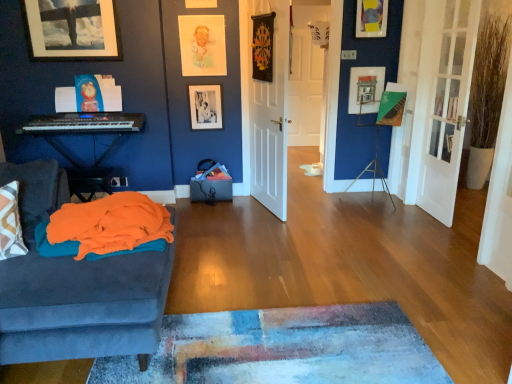
The height and width of the screenshot is (384, 512). What do you see at coordinates (371, 18) in the screenshot? I see `wooden picture frame at upper center, which appears as the 4th picture frame when viewed from the left` at bounding box center [371, 18].

Find the location of a particular element. The image size is (512, 384). orange fabric at left is located at coordinates (84, 133).

Describe the element at coordinates (306, 76) in the screenshot. I see `white wooden door at center, the first door viewed from the back` at that location.

The height and width of the screenshot is (384, 512). What do you see at coordinates (202, 45) in the screenshot?
I see `pastel paper portrait at upper center, which is counted as the third picture frame, starting from the right` at bounding box center [202, 45].

In order to face white matte door at center, acting as the second door starting from the back, should I rotate leftwards or rightwards?

Rotate your view right by about 1.167°.

This screenshot has height=384, width=512. I want to click on white glass door at right, which is counted as the first door, starting from the right, so click(x=442, y=103).

Locate an element on the screen. The width and height of the screenshot is (512, 384). matte black picture frame at upper left, which ranks as the fifth picture frame in right-to-left order is located at coordinates (72, 29).

Where is `wooden picture frame at upper center, which appears as the 4th picture frame when viewed from the left`? This screenshot has height=384, width=512. wooden picture frame at upper center, which appears as the 4th picture frame when viewed from the left is located at coordinates (371, 18).

Can white wooden door at center, the 2th door when ordered from right to left, be found inside orange soft fabric blanket at left?

No.

From a real-world perspective, does orange soft fabric blanket at left stand above white wooden door at center, the 2th door when ordered from right to left?

Incorrect, from a real-world perspective, orange soft fabric blanket at left is lower than white wooden door at center, the 2th door when ordered from right to left.

Who is more distant, orange soft fabric blanket at left or white wooden door at center, the first door viewed from the back?

Positioned behind is white wooden door at center, the first door viewed from the back.

From the image's perspective, is white glass door at right, the third door from the back, on matte black picture frame at upper left, the 1th picture frame from the left?

No, from the image's perspective, white glass door at right, the third door from the back, is not over matte black picture frame at upper left, the 1th picture frame from the left.

Considering the relative sizes of white glass door at right, the first door from the front, and matte black picture frame at upper left, the 1th picture frame from the left, in the image provided, is white glass door at right, the first door from the front, smaller than matte black picture frame at upper left, the 1th picture frame from the left,?

No, white glass door at right, the first door from the front, is not smaller than matte black picture frame at upper left, the 1th picture frame from the left.

Can you confirm if white glass door at right, the first door from the front, is taller than matte black picture frame at upper left, which ranks as the fifth picture frame in right-to-left order?

Yes.

Considering the positions of objects white glass door at right, acting as the third door starting from the left, and matte black picture frame at upper left, which ranks as the fifth picture frame in right-to-left order, in the image provided, who is more to the left, white glass door at right, acting as the third door starting from the left, or matte black picture frame at upper left, which ranks as the fifth picture frame in right-to-left order,?

matte black picture frame at upper left, which ranks as the fifth picture frame in right-to-left order.

Does white matte door at center, which ranks as the 2th door in front-to-back order, lie behind white wooden door at center, the 3th door from the front?

That is False.

Based on the photo, is white wooden door at center, the 2th door viewed from the left, a part of white matte door at center, acting as the second door starting from the back?

Actually, white wooden door at center, the 2th door viewed from the left, is outside white matte door at center, acting as the second door starting from the back.

The image size is (512, 384). In order to click on door lying above the white matte door at center, arranged as the 3th door when viewed from the right (from the image's perspective) in this screenshot , I will do `click(306, 76)`.

Based on the photo, considering the positions of objects textured wool rug at lower center and orange fabric at left in the image provided, who is more to the right, textured wool rug at lower center or orange fabric at left?

Positioned to the right is textured wool rug at lower center.

Is textured wool rug at lower center in front of or behind orange fabric at left in the image?

textured wool rug at lower center is positioned closer to the viewer than orange fabric at left.

How many degrees apart are the facing directions of textured wool rug at lower center and orange fabric at left?

The angle between the facing direction of textured wool rug at lower center and the facing direction of orange fabric at left is 85.9 degrees.

Does textured wool rug at lower center have a lesser height compared to orange fabric at left?

Yes, textured wool rug at lower center is shorter than orange fabric at left.

Based on their sizes in the image, would you say pastel paper portrait at upper center, which is counted as the third picture frame, starting from the right, is bigger or smaller than textured wool rug at lower center?

Clearly, pastel paper portrait at upper center, which is counted as the third picture frame, starting from the right, is smaller in size than textured wool rug at lower center.

The image size is (512, 384). Identify the location of the 2nd picture frame behind the textured wool rug at lower center, counting from the anchor's position. 202,45.

Based on the photo, does pastel paper portrait at upper center, the 3th picture frame from the left, have a greater height compared to textured wool rug at lower center?

Indeed, pastel paper portrait at upper center, the 3th picture frame from the left, has a greater height compared to textured wool rug at lower center.

Is pastel paper portrait at upper center, which is counted as the third picture frame, starting from the right, far from textured wool rug at lower center?

Yes, pastel paper portrait at upper center, which is counted as the third picture frame, starting from the right, is far from textured wool rug at lower center.

From the image's perspective, who appears lower, textured wool rug at lower center or wooden picture frame at upper center, the second picture frame viewed from the right?

textured wool rug at lower center is shown below in the image.

Does textured wool rug at lower center have a greater height compared to wooden picture frame at upper center, the second picture frame viewed from the right?

In fact, textured wool rug at lower center may be shorter than wooden picture frame at upper center, the second picture frame viewed from the right.

Between textured wool rug at lower center and wooden picture frame at upper center, which appears as the 4th picture frame when viewed from the left, which one appears on the right side from the viewer's perspective?

wooden picture frame at upper center, which appears as the 4th picture frame when viewed from the left.

Would you consider textured wool rug at lower center to be distant from wooden picture frame at upper center, the second picture frame viewed from the right?

Yes, textured wool rug at lower center is far from wooden picture frame at upper center, the second picture frame viewed from the right.

Is orange soft fabric blanket at left positioned far away from matte black keyboard at left?

Absolutely, orange soft fabric blanket at left is distant from matte black keyboard at left.

In the scene shown: Between orange soft fabric blanket at left and matte black keyboard at left, which one has larger width?

orange soft fabric blanket at left is wider.

Does orange soft fabric blanket at left have a larger size compared to matte black keyboard at left?

No.

Locate an element on the screen. This screenshot has width=512, height=384. blanket in front of the white wooden door at center, the first door viewed from the back is located at coordinates (105, 228).

Locate an element on the screen. The width and height of the screenshot is (512, 384). the 5th picture frame to the left when counting from the white glass door at right, the third door from the back is located at coordinates (72, 29).

Based on their spatial positions, is white glass door at right, the third door from the back, or wooden picture frame at upper center, the second picture frame viewed from the right, further from pastel paper portrait at upper center, which is counted as the third picture frame, starting from the right?

white glass door at right, the third door from the back.

Based on their spatial positions, is matte wooden picture frame at center, placed as the 1th picture frame when sorted from right to left, or white glass door at right, the first door from the front, further from matte black picture frame at upper left, the 1th picture frame from the left?

Among the two, white glass door at right, the first door from the front, is located further to matte black picture frame at upper left, the 1th picture frame from the left.

When comparing their distances from white glass door at right, acting as the third door starting from the left, does orange fabric at left or white wooden door at center, the 2th door when ordered from right to left, seem further?

orange fabric at left lies further to white glass door at right, acting as the third door starting from the left, than the other object.

In the scene shown: When comparing their distances from matte black keyboard at left, does white glass door at right, the third door from the back, or orange soft fabric blanket at left seem further?

white glass door at right, the third door from the back, lies further to matte black keyboard at left than the other object.

Based on their spatial positions, is textured wool rug at lower center or orange fabric at left closer to matte black picture frame at upper left, which ranks as the fifth picture frame in right-to-left order?

orange fabric at left lies closer to matte black picture frame at upper left, which ranks as the fifth picture frame in right-to-left order, than the other object.

Considering their positions, is white matte door at center, acting as the second door starting from the back, positioned further to wooden picture frame at upper center, the second picture frame viewed from the right, than textured wool rug at lower center?

textured wool rug at lower center is positioned further to the anchor wooden picture frame at upper center, the second picture frame viewed from the right.

From the picture: From the image, which object appears to be farther from wooden picture frame at upper center, the second picture frame viewed from the right, black matte picture frame at upper center, the 4th picture frame viewed from the right, or matte black keyboard at left?

matte black keyboard at left lies further to wooden picture frame at upper center, the second picture frame viewed from the right, than the other object.

When comparing their distances from matte black keyboard at left, does pastel paper portrait at upper center, the 3th picture frame from the left, or black matte picture frame at upper center, the 4th picture frame viewed from the right, seem further?

pastel paper portrait at upper center, the 3th picture frame from the left, is positioned further to the anchor matte black keyboard at left.

Where is `musical keyboard between orange soft fabric blanket at left and pastel paper portrait at upper center, the 3th picture frame from the left, along the z-axis`? musical keyboard between orange soft fabric blanket at left and pastel paper portrait at upper center, the 3th picture frame from the left, along the z-axis is located at coordinates (83, 123).

This screenshot has height=384, width=512. Find the location of `musical keyboard located between white matte door at center, acting as the second door starting from the back, and white wooden door at center, the first door viewed from the back, in the depth direction`. musical keyboard located between white matte door at center, acting as the second door starting from the back, and white wooden door at center, the first door viewed from the back, in the depth direction is located at coordinates (83, 123).

The height and width of the screenshot is (384, 512). In order to click on table between textured wool rug at lower center and black matte picture frame at upper center, the 4th picture frame viewed from the right, from front to back in this screenshot , I will do coord(84,133).

Identify the location of musical keyboard positioned between orange soft fabric blanket at left and orange fabric at left from near to far. The image size is (512, 384). (83, 123).